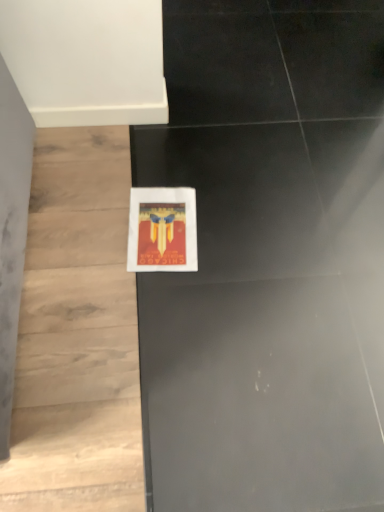
The image size is (384, 512). I want to click on vacant space underneath matte paper picture frame at center (from a real-world perspective), so click(x=161, y=228).